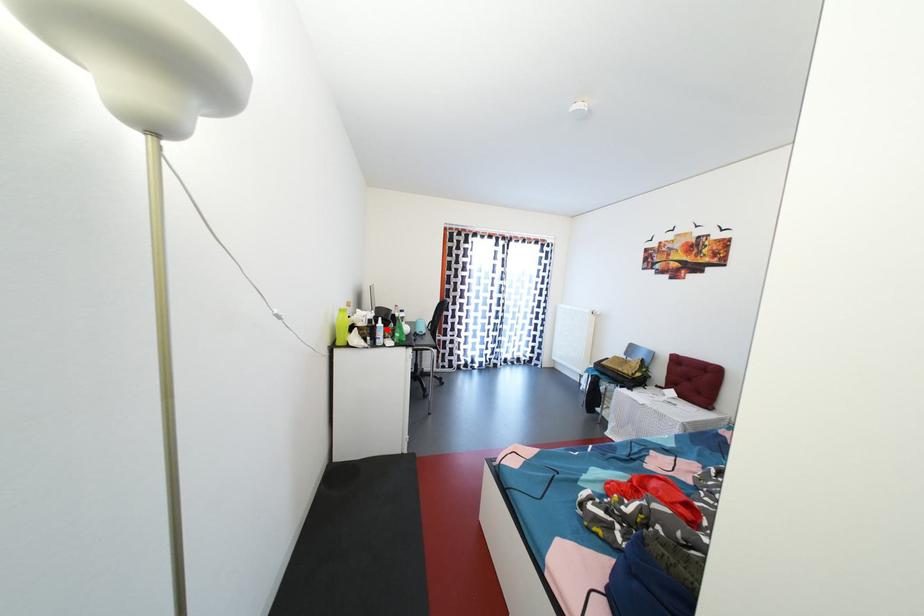
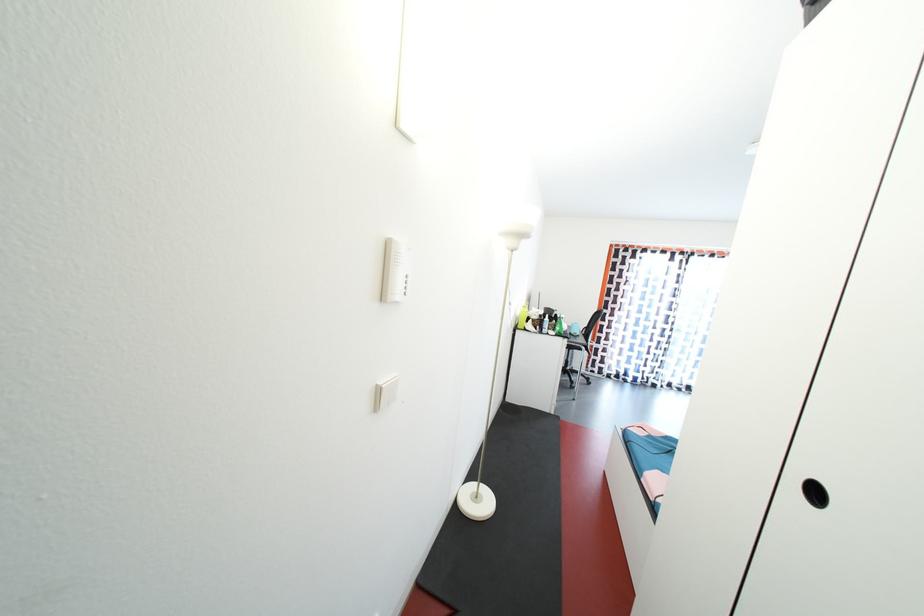
Question: I am providing you with two images of the same scene from different viewpoints. A red point is marked on the first image. At the location where the point appears in image 1, is it still visible in image 2?

Choices:
 (A) Yes
 (B) No

Answer: (A)